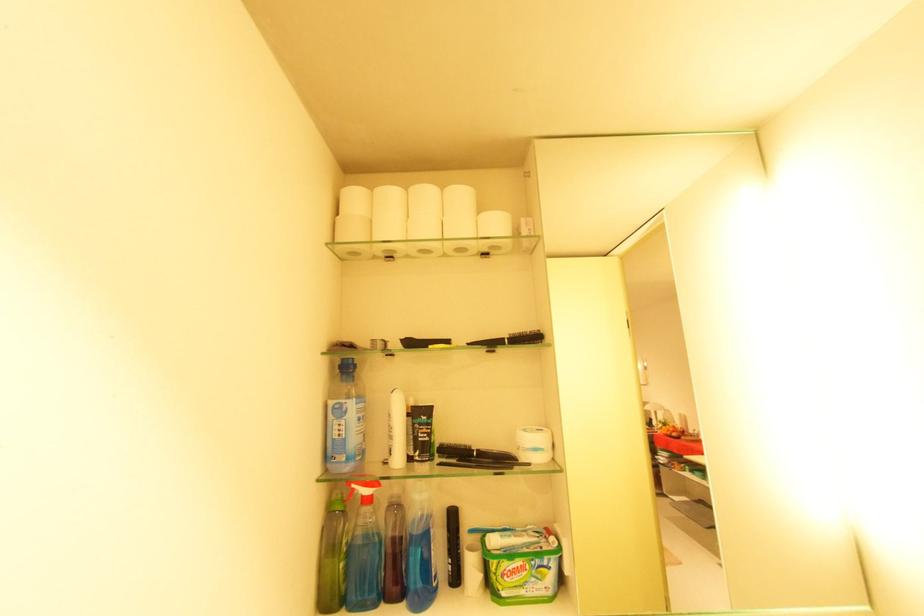
The location [453,546] corresponds to which object?

It corresponds to the black cosmetic tube in the image.